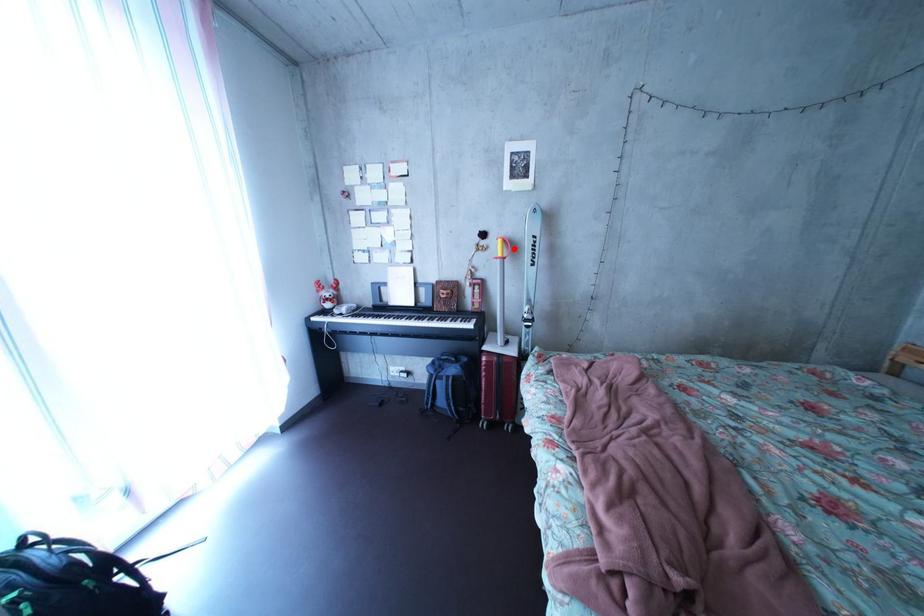
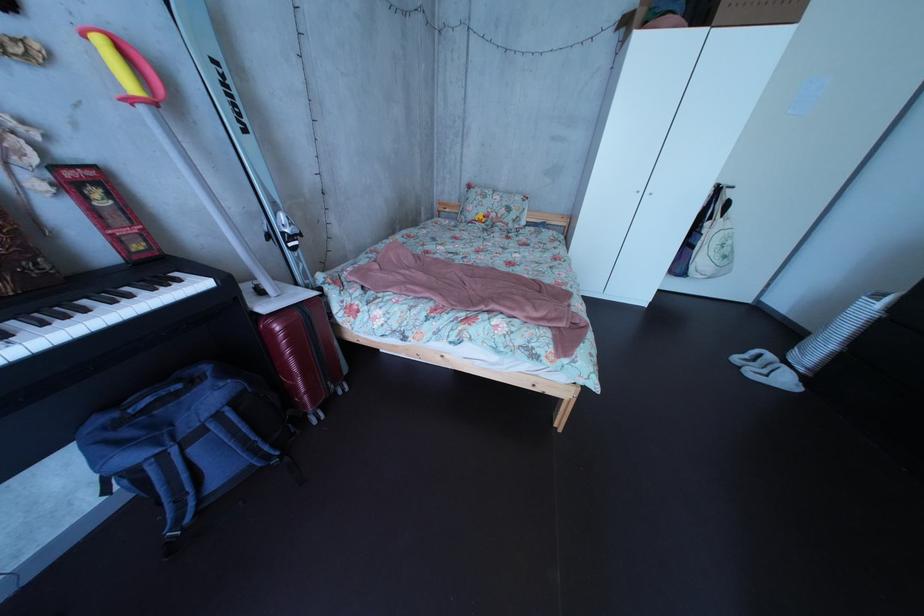
In the second image, find the point that corresponds to the highlighted location in the first image.

(116, 51)